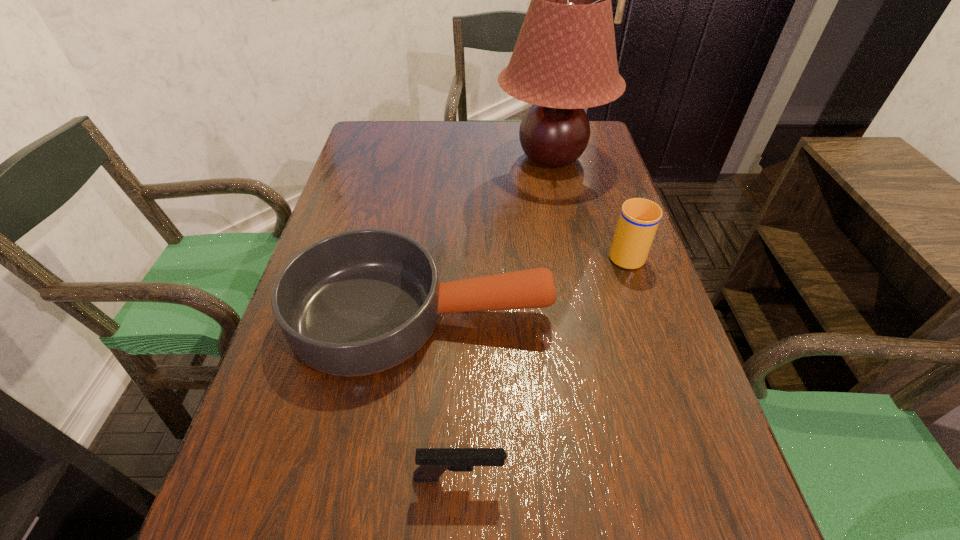
Where is `vacant position at the left edge of the desktop`? vacant position at the left edge of the desktop is located at coordinates (311, 380).

The image size is (960, 540). In the image, there is a desktop. What are the coordinates of `free space at the right edge` in the screenshot? It's located at (575, 226).

The image size is (960, 540). Find the location of `vacant point at the far left corner`. vacant point at the far left corner is located at coordinates click(407, 136).

Locate an element on the screen. Image resolution: width=960 pixels, height=540 pixels. free space between the lampshade and the pan is located at coordinates (486, 236).

Image resolution: width=960 pixels, height=540 pixels. What are the coordinates of `vacant space that's between the cup and the farthest object` in the screenshot? It's located at (588, 205).

Locate an element on the screen. This screenshot has height=540, width=960. vacant region between the lampshade and the second tallest object is located at coordinates (588, 205).

Where is `object identified as the third closest to the cup`? This screenshot has width=960, height=540. object identified as the third closest to the cup is located at coordinates (433, 462).

What are the coordinates of `object that can be found as the closest to the third tallest object` in the screenshot? It's located at (639, 218).

At what (x,y) coordinates should I click in order to perform the action: click on free location that satisfies the following two spatial constraints: 1. on the front-facing side of the farthest object; 2. on the side of the cup with the handle. Please return your answer as a coordinate pair (x, y). The height and width of the screenshot is (540, 960). Looking at the image, I should click on (571, 252).

The height and width of the screenshot is (540, 960). What are the coordinates of `free spot that satisfies the following two spatial constraints: 1. on the front-facing side of the farthest object; 2. on the side of the cup with the handle` in the screenshot? It's located at (571, 252).